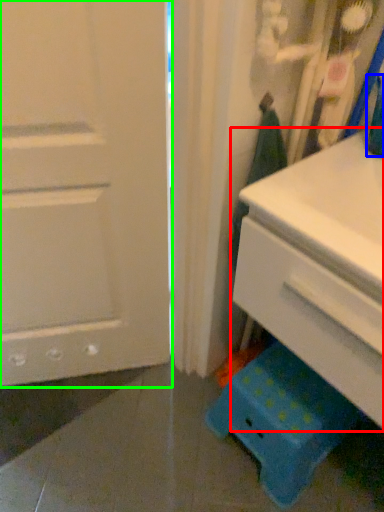
Question: Which object is positioned farthest from chest of drawers (highlighted by a red box)? Select from teal (highlighted by a blue box) and door (highlighted by a green box).

Choices:
 (A) teal
 (B) door

Answer: (B)